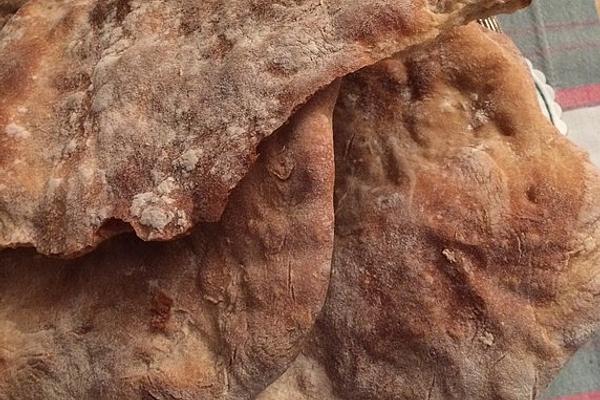
This screenshot has height=400, width=600. I want to click on green and red placemats, so click(x=570, y=55), click(x=587, y=371).